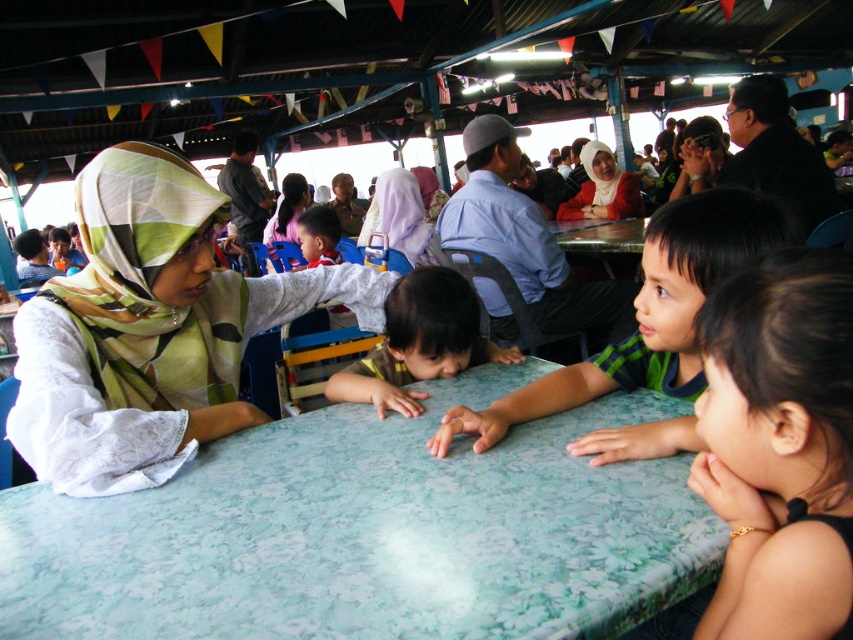
You are a photographer taking a picture of the children at the table. You want to ensure both the white lace shirt at center and the light purple fabric headscarf at center are clearly visible in the photo. Which object should you focus on first to make sure both are in focus?

The light purple fabric headscarf at center is above the white lace shirt at center, so focusing on the headscarf first will ensure both are in focus as it is closer to the camera.

You are a photographer trying to capture a candid shot of the smooth skin child at center without including the dark brown hair at lower right in the frame. Based on their positions, is this possible?

The dark brown hair at lower right is in front of the smooth skin child at center, so the photographer cannot capture the smooth skin child at center without including the dark brown hair at lower right in the frame.